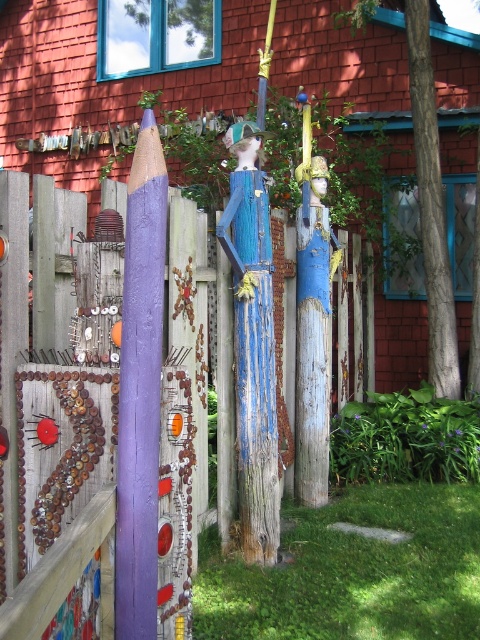
You are standing at the point with coordinates point (x=142, y=512) and want to walk to the point with coordinates point (x=336, y=332). Is the destination point visible from your current position?

The destination point point (x=336, y=332) is behind point (x=142, y=512), so it is not visible from your current position.

You are a painter who needs to place a ladder to paint the wooden fence at center and the purple painted wood at center. Which object requires a taller ladder?

The purple painted wood at center requires a taller ladder because it has a greater height than the wooden fence at center.